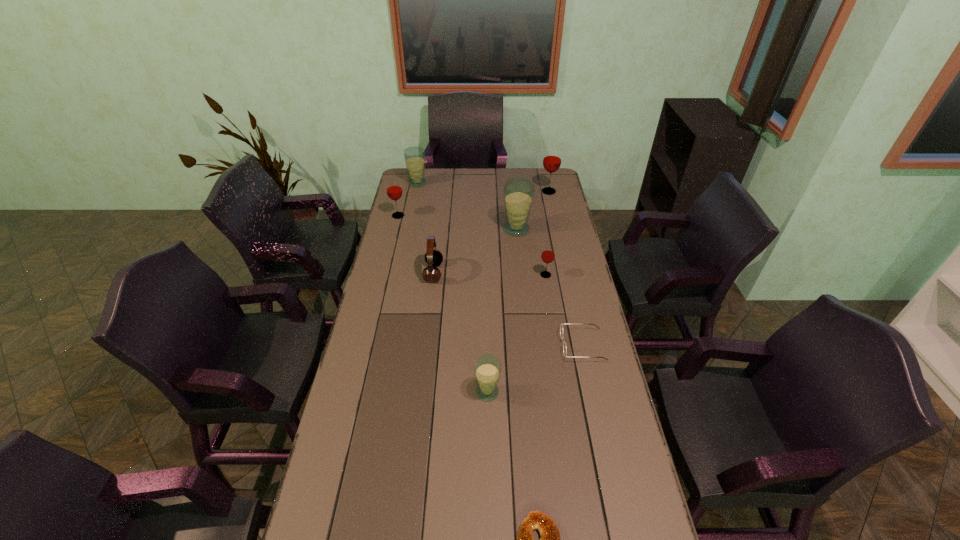
Find the location of `free space at the right edge`. free space at the right edge is located at coordinates (585, 410).

Identify the location of vacant space at the far left corner of the desktop. (431, 172).

This screenshot has width=960, height=540. Find the location of `free spot between the second nearest red glass and the leftmost blue glass`. free spot between the second nearest red glass and the leftmost blue glass is located at coordinates (408, 200).

At what (x,y) coordinates should I click in order to perform the action: click on empty space between the third nearest glass and the smallest red glass. Please return your answer as a coordinate pair (x, y). The image size is (960, 540). Looking at the image, I should click on (531, 252).

This screenshot has width=960, height=540. What are the coordinates of `free spot between the third nearest glass and the second blue glass from right to left` in the screenshot? It's located at click(x=502, y=310).

You are a GUI agent. You are given a task and a screenshot of the screen. Output one action in this format:
    pyautogui.click(x=<x>, y=<y>)
    Task: Click on the vacant space that's between the farthest blue glass and the fourth nearest glass
    This screenshot has width=960, height=540.
    Given the screenshot: What is the action you would take?
    [408, 200]

You are a GUI agent. You are given a task and a screenshot of the screen. Output one action in this format:
    pyautogui.click(x=<x>, y=<y>)
    Task: Click on the vacant space that's between the fourth nearest glass and the fifth glass from left to right
    This screenshot has width=960, height=540.
    Given the screenshot: What is the action you would take?
    (x=471, y=245)

Find the location of a particular element. vacant area that lies between the leftmost blue glass and the nearest red glass is located at coordinates (482, 229).

Locate which object is the second closest to the shortest object. Please provide its 2D coordinates. Your answer should be formatted as a tuple, i.e. [(x, y)], where the tuple contains the x and y coordinates of a point satisfying the conditions above.

[(561, 326)]

Where is `object that is the fourth closest to the farthest red glass`? Image resolution: width=960 pixels, height=540 pixels. object that is the fourth closest to the farthest red glass is located at coordinates (394, 191).